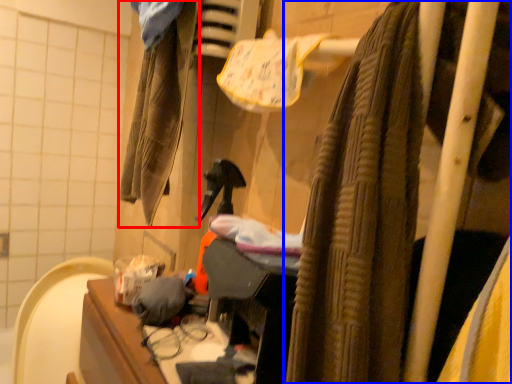
Question: Which object is closer to the camera taking this photo, clothing (highlighted by a red box) or curtain (highlighted by a blue box)?

Choices:
 (A) clothing
 (B) curtain

Answer: (B)